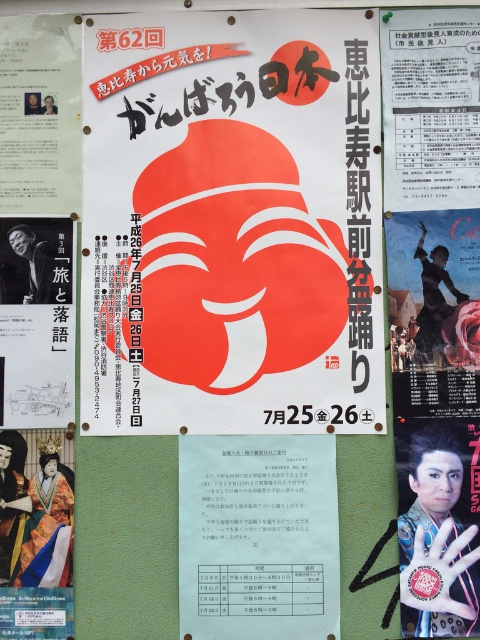
You are an event planner looking at the bulletin board. You see the matte red mask at center and the white paper at center. Which object is taller?

The matte red mask at center is much taller than the white paper at center.